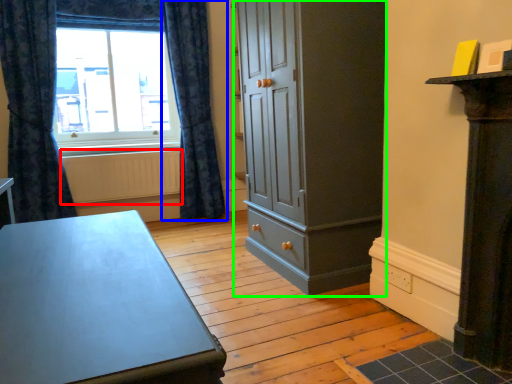
Question: Estimate the real-world distances between objects in this image. Which object is closer to radiator (highlighted by a red box), curtain (highlighted by a blue box) or cupboard (highlighted by a green box)?

Choices:
 (A) curtain
 (B) cupboard

Answer: (A)